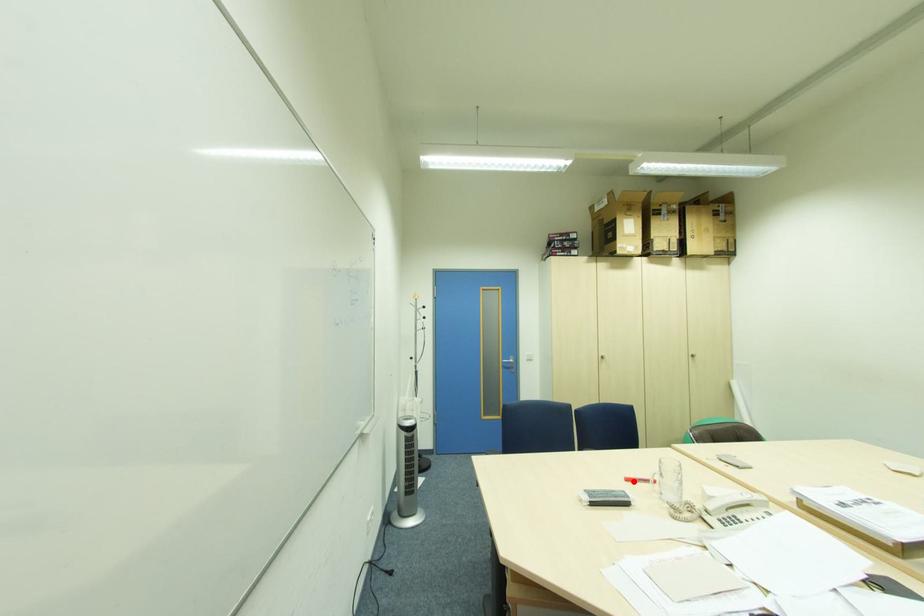
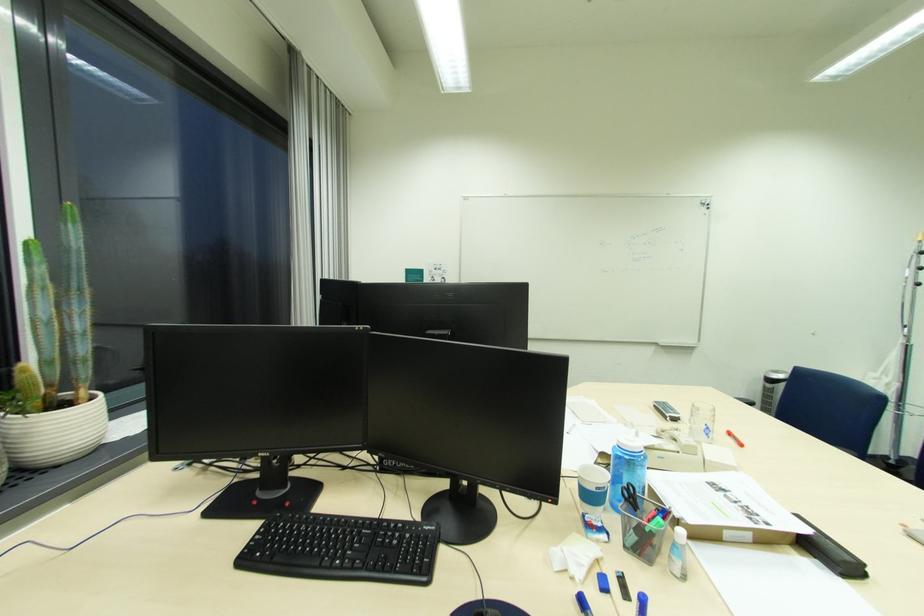
The point at the highlighted location is marked in the first image. Where is the corresponding point in the second image?

(736, 435)